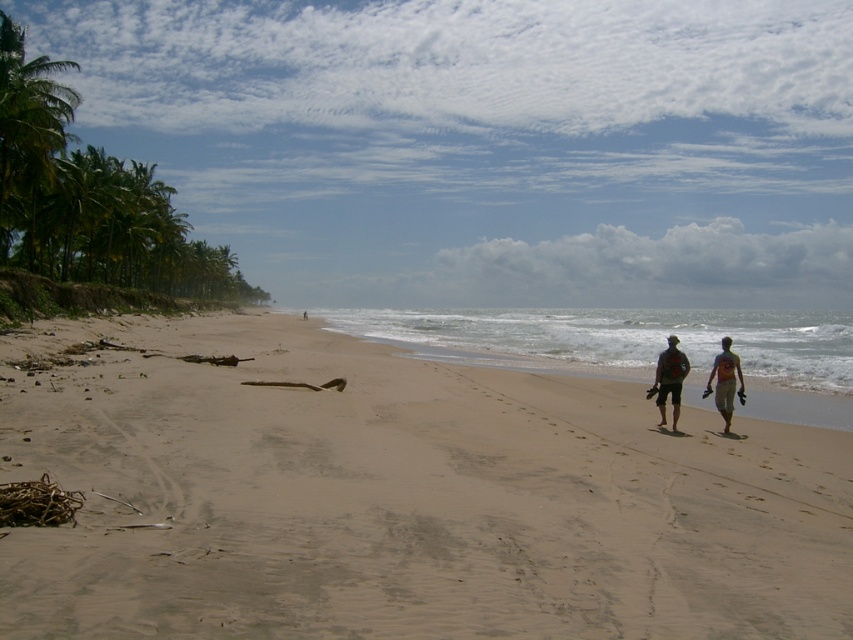
Does sandy beach at center have a lesser width compared to light blue fabric shorts at lower right?

In fact, sandy beach at center might be wider than light blue fabric shorts at lower right.

Between sandy beach at center and light blue fabric shorts at lower right, which one appears on the left side from the viewer's perspective?

sandy beach at center

Image resolution: width=853 pixels, height=640 pixels. Describe the element at coordinates (401, 499) in the screenshot. I see `sandy beach at center` at that location.

In order to click on sandy beach at center in this screenshot , I will do `click(401, 499)`.

Measure the distance between sandy beach at center and camera.

sandy beach at center and camera are 4.49 meters apart.

Based on the photo, is sandy beach at center further to the viewer compared to matte red shorts at lower right?

No, sandy beach at center is in front of matte red shorts at lower right.

You are a GUI agent. You are given a task and a screenshot of the screen. Output one action in this format:
    pyautogui.click(x=<x>, y=<y>)
    Task: Click on the sandy beach at center
    
    Given the screenshot: What is the action you would take?
    pyautogui.click(x=401, y=499)

Find the location of a particular element. The height and width of the screenshot is (640, 853). matte red shorts at lower right is located at coordinates (669, 378).

Which is behind, point (735, 390) or point (688, 364)?

Point (735, 390)

Locate an element on the screen. The height and width of the screenshot is (640, 853). matte red shorts at lower right is located at coordinates (669, 378).